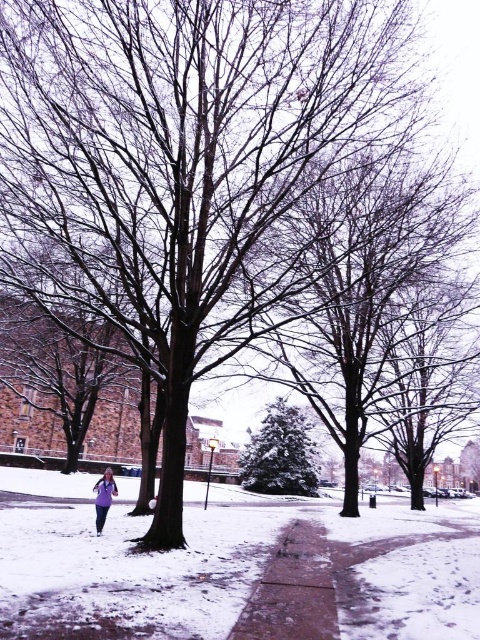
You are a snowplow operator trying to clear the sandy concrete sidewalk at center. You need to know if the green textured evergreen tree at center is in the way of the sidewalk. Can you determine if the tree is blocking the sidewalk?

The sandy concrete sidewalk at center might be wider than green textured evergreen tree at center, so there is a possibility that the tree is not blocking the sidewalk. However, without exact measurements, it is uncertain.

You are standing at point (x=233, y=566) in the winter scene. What is the surface you are standing on?

The surface at point (x=233, y=566) is sandy concrete sidewalk at center.